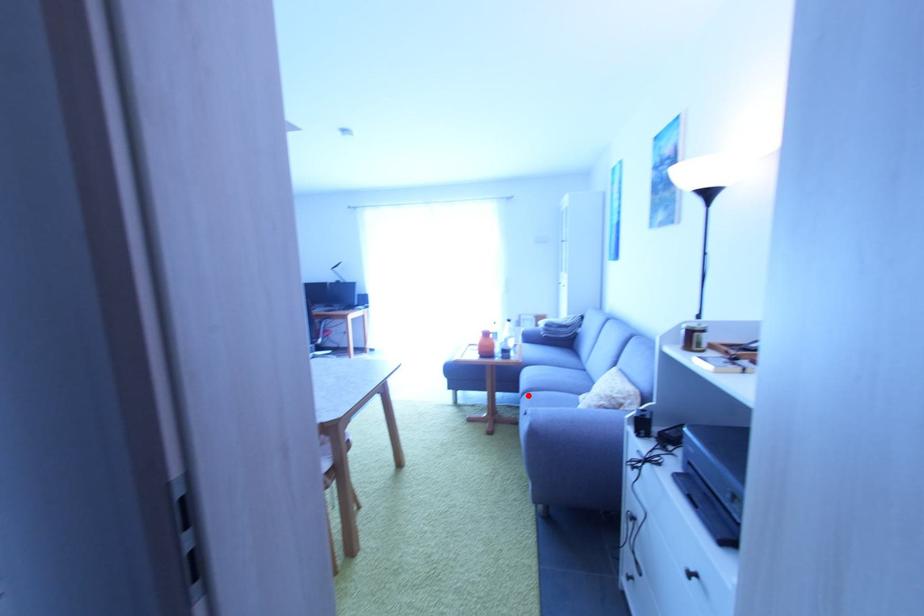
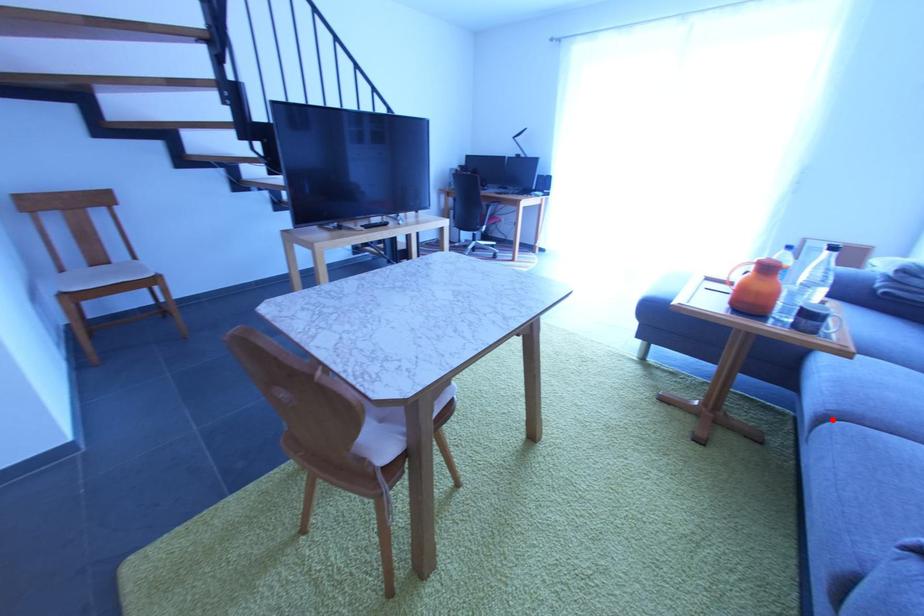
I am providing you with two images of the same scene from different viewpoints. A red point is marked on the first image and another point is marked on the second image. Does the point marked in image1 correspond to the same location as the one in image2?

Yes